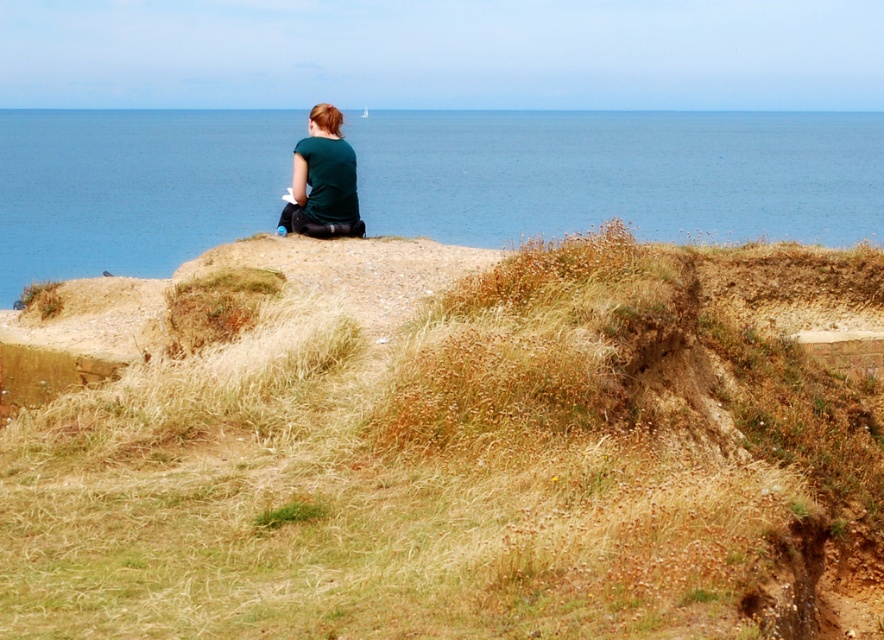
Question: Can you confirm if blue water at upper center is positioned to the right of matte green shirt at center?

Choices:
 (A) yes
 (B) no

Answer: (A)

Question: Which object appears closest to the camera in this image?

Choices:
 (A) matte green shirt at center
 (B) brown grassy hillside at upper center
 (C) blue water at upper center

Answer: (B)

Question: Does brown grassy hillside at upper center have a lesser width compared to matte green shirt at center?

Choices:
 (A) yes
 (B) no

Answer: (B)

Question: Which of the following is the farthest from the observer?

Choices:
 (A) (290, 212)
 (B) (235, 140)

Answer: (B)

Question: Considering the real-world distances, which object is closest to the blue water at upper center?

Choices:
 (A) matte green shirt at center
 (B) brown grassy hillside at upper center

Answer: (A)

Question: Is blue water at upper center to the right of matte green shirt at center from the viewer's perspective?

Choices:
 (A) yes
 (B) no

Answer: (A)